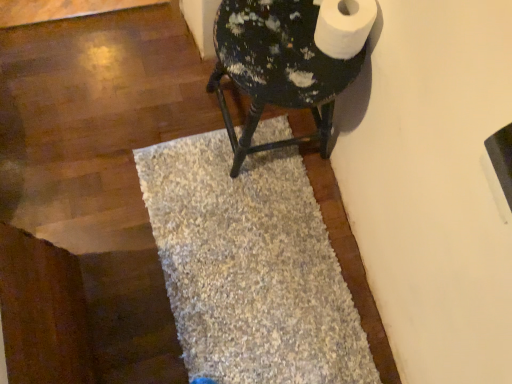
In order to click on empty space that is ontop of beige shaggy bath mat at center (from a real-world perspective) in this screenshot , I will do `click(255, 267)`.